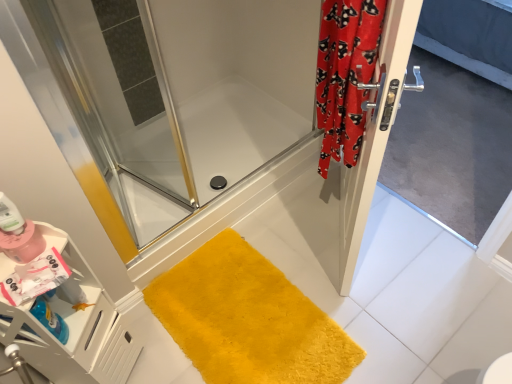
Question: Should I look upward or downward to see silver metallic screen door at right?

Choices:
 (A) down
 (B) up

Answer: (B)

Question: From a real-world perspective, is silver metallic screen door at right below matte pink bottle at lower left?

Choices:
 (A) yes
 (B) no

Answer: (A)

Question: Is silver metallic screen door at right closer to the viewer compared to matte pink bottle at lower left?

Choices:
 (A) yes
 (B) no

Answer: (B)

Question: Is silver metallic screen door at right wider than matte pink bottle at lower left?

Choices:
 (A) yes
 (B) no

Answer: (A)

Question: Is silver metallic screen door at right to the right of matte pink bottle at lower left from the viewer's perspective?

Choices:
 (A) no
 (B) yes

Answer: (B)

Question: Can you confirm if silver metallic screen door at right is bigger than matte pink bottle at lower left?

Choices:
 (A) yes
 (B) no

Answer: (A)

Question: Is matte pink bottle at lower left inside silver metallic screen door at right?

Choices:
 (A) no
 (B) yes

Answer: (A)

Question: Is matte pink bottle at lower left oriented away from yellow plush bath mat at lower center?

Choices:
 (A) no
 (B) yes

Answer: (A)

Question: From the image's perspective, is matte pink bottle at lower left located above yellow plush bath mat at lower center?

Choices:
 (A) yes
 (B) no

Answer: (A)

Question: Is matte pink bottle at lower left facing towards yellow plush bath mat at lower center?

Choices:
 (A) yes
 (B) no

Answer: (B)

Question: Is matte pink bottle at lower left surrounding yellow plush bath mat at lower center?

Choices:
 (A) no
 (B) yes

Answer: (A)

Question: Would you say matte pink bottle at lower left is outside yellow plush bath mat at lower center?

Choices:
 (A) no
 (B) yes

Answer: (B)

Question: Would you consider matte pink bottle at lower left to be distant from yellow plush bath mat at lower center?

Choices:
 (A) yes
 (B) no

Answer: (B)

Question: Is yellow plush bath mat at lower center outside red velvet curtain at right?

Choices:
 (A) yes
 (B) no

Answer: (A)